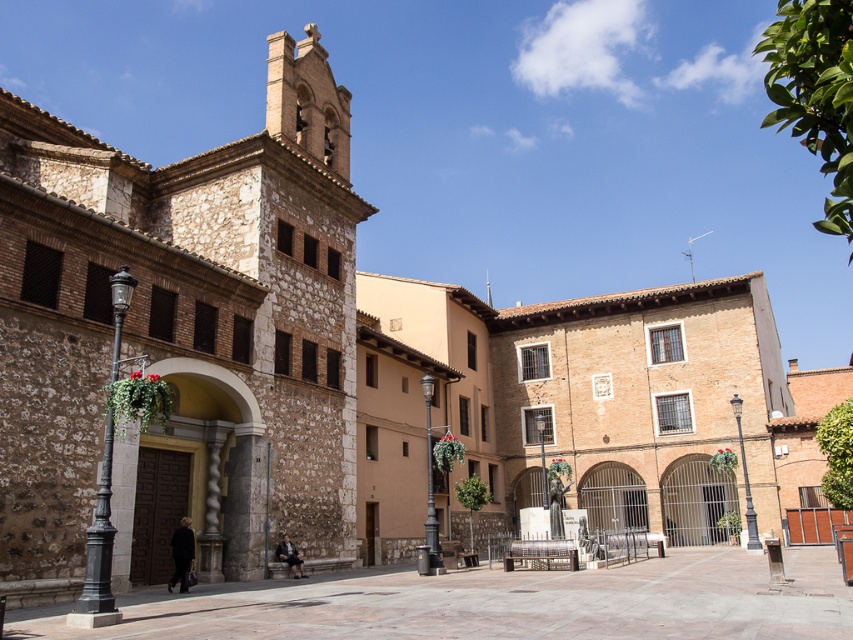
Where is `brown stone church at left`? brown stone church at left is located at coordinates (180, 339).

Is point (80, 296) in front of point (714, 560)?

Yes, point (80, 296) is in front of point (714, 560).

The height and width of the screenshot is (640, 853). Find the location of `brown stone church at left`. brown stone church at left is located at coordinates (180, 339).